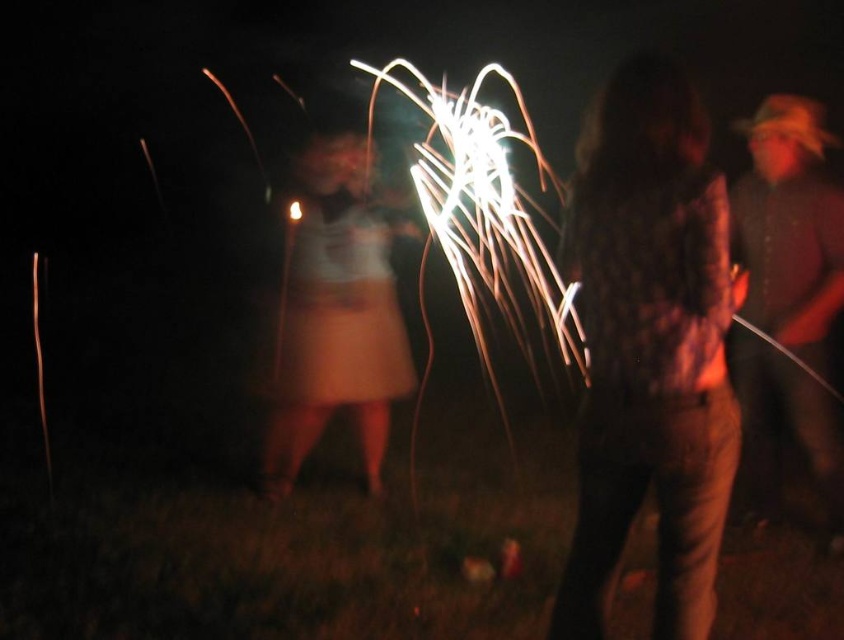
Does white matte dress at center come behind brown textured shirt at right?

Yes, it is behind brown textured shirt at right.

The image size is (844, 640). I want to click on white matte dress at center, so click(x=334, y=317).

Is fluffy brown coat at center behind brown textured shirt at right?

No, fluffy brown coat at center is closer to the viewer.

In the scene shown: Does fluffy brown coat at center appear on the left side of brown textured shirt at right?

Result: Correct, you'll find fluffy brown coat at center to the left of brown textured shirt at right.

Is point (599, 93) positioned after point (831, 547)?

No, it is not.

At what (x,y) coordinates should I click in order to perform the action: click on fluffy brown coat at center. Please return your answer as a coordinate pair (x, y). The image size is (844, 640). Looking at the image, I should click on (648, 348).

Is fluffy brown coat at center above white matte dress at center?

No.

Between point (690, 321) and point (268, 460), which one is positioned in front?

Point (690, 321) is in front.

Where is `fluffy brown coat at center`? fluffy brown coat at center is located at coordinates click(x=648, y=348).